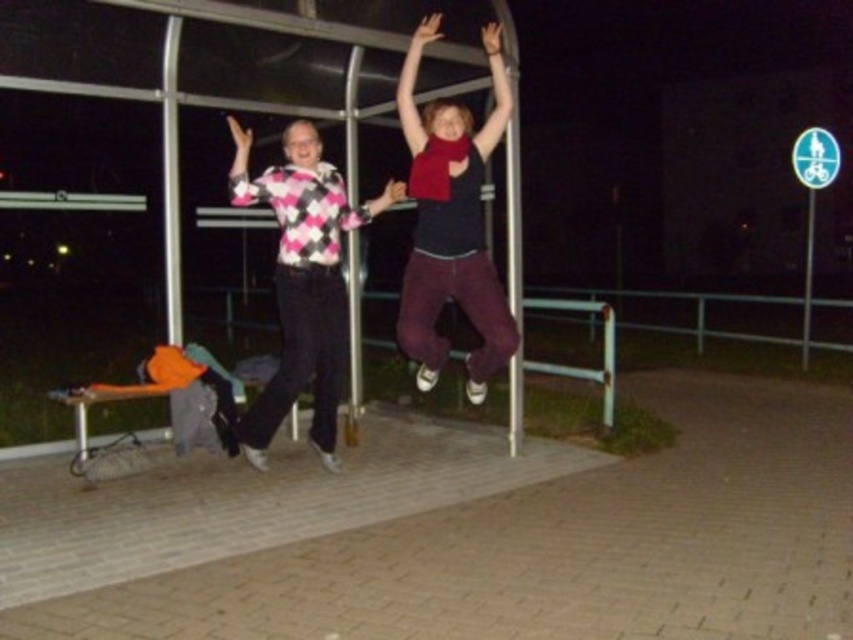
You are a photographer trying to capture a closeup shot of the matte red scarf at upper center and the pink argyle sweater at center. Given that your camera can only focus on objects within a 30 inch range, will you be able to get both in focus?

The matte red scarf at upper center is 33.95 inches from the pink argyle sweater at center, which exceeds the camera focus range of 30 inches. Therefore, you cannot get both in focus.

You are standing in front of the metal structure and want to place a small decoration on the closer of the two points, point [428,218] and point [242,163]. Which point should you choose?

Point [428,218] is closer to the viewer than point [242,163], so you should choose point [428,218].

You are a photographer trying to capture a photo of both the matte red scarf at upper center and the pink argyle sweater at center. Which object should you focus on first to ensure both are in sharp focus?

You should focus on the matte red scarf at upper center first because it is closer to the viewer than the pink argyle sweater at center, ensuring both will be in focus when focusing on the closer object first.